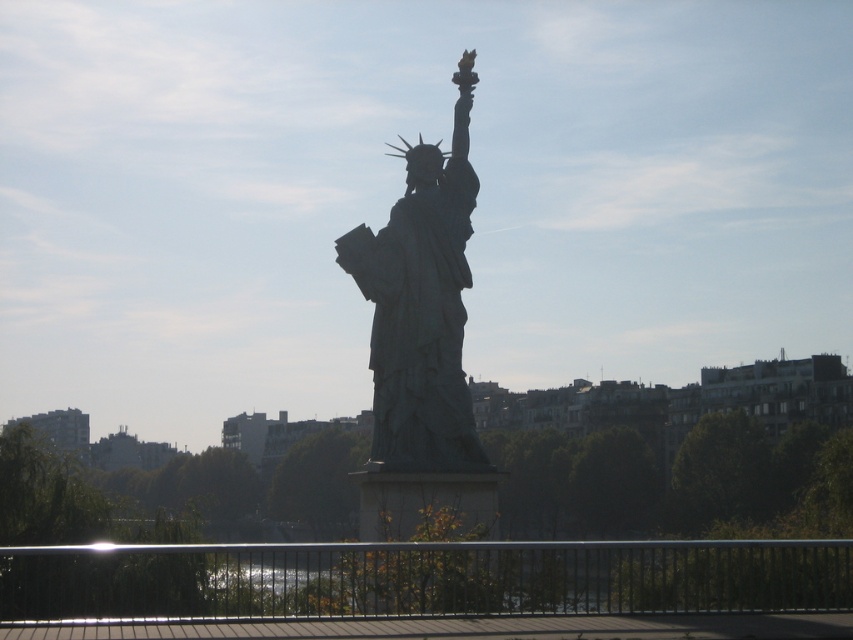
Question: Is black metal railing at lower center positioned at the back of green patina statue at center?

Choices:
 (A) yes
 (B) no

Answer: (B)

Question: Among these objects, which one is farthest from the camera?

Choices:
 (A) green patina statue at center
 (B) black metal railing at lower center

Answer: (A)

Question: Is black metal railing at lower center smaller than green patina statue at center?

Choices:
 (A) yes
 (B) no

Answer: (B)

Question: Can you confirm if black metal railing at lower center is positioned above green patina statue at center?

Choices:
 (A) no
 (B) yes

Answer: (A)